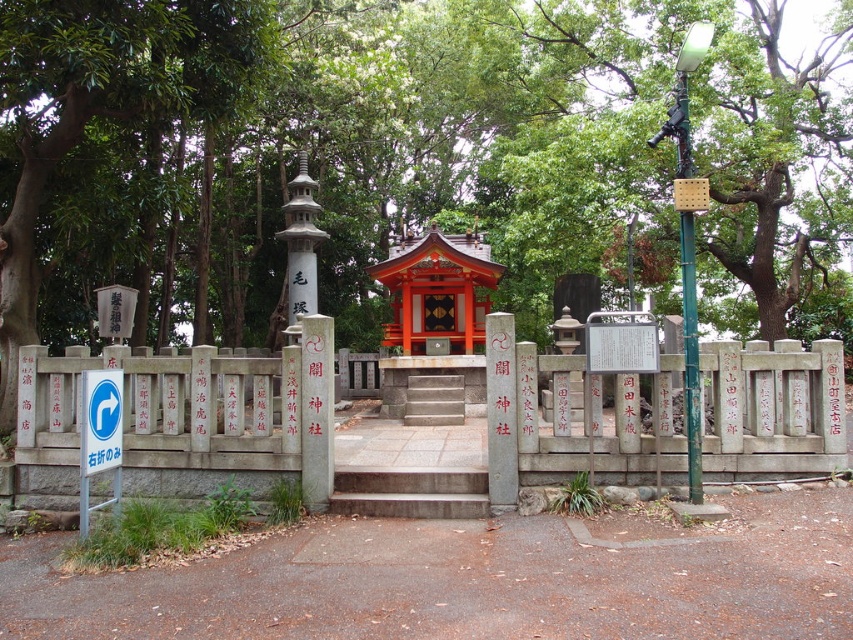
Who is more forward, (654, 186) or (477, 310)?

Point (477, 310) is in front.

You are a GUI agent. You are given a task and a screenshot of the screen. Output one action in this format:
    pyautogui.click(x=<x>, y=<y>)
    Task: Click on the green leafy tree at center
    This screenshot has width=853, height=640.
    Given the screenshot: What is the action you would take?
    pyautogui.click(x=392, y=148)

The image size is (853, 640). Find the location of `green leafy tree at center`. green leafy tree at center is located at coordinates (392, 148).

Does gray stone fence at center have a lesser height compared to white plastic sign at center?

Indeed, gray stone fence at center has a lesser height compared to white plastic sign at center.

Between gray stone fence at center and white plastic sign at center, which one appears on the right side from the viewer's perspective?

gray stone fence at center is more to the right.

Is point (805, 380) more distant than point (99, 436)?

Yes, it is behind point (99, 436).

Identify the location of gray stone fence at center. The image size is (853, 640). (183, 419).

Can you confirm if green leafy tree at center is positioned to the right of white plastic sign at center?

Yes, green leafy tree at center is to the right of white plastic sign at center.

Who is higher up, green leafy tree at center or white plastic sign at center?

green leafy tree at center is higher up.

This screenshot has height=640, width=853. Identify the location of green leafy tree at center. click(x=392, y=148).

Where is `green leafy tree at center`? This screenshot has width=853, height=640. green leafy tree at center is located at coordinates (392, 148).